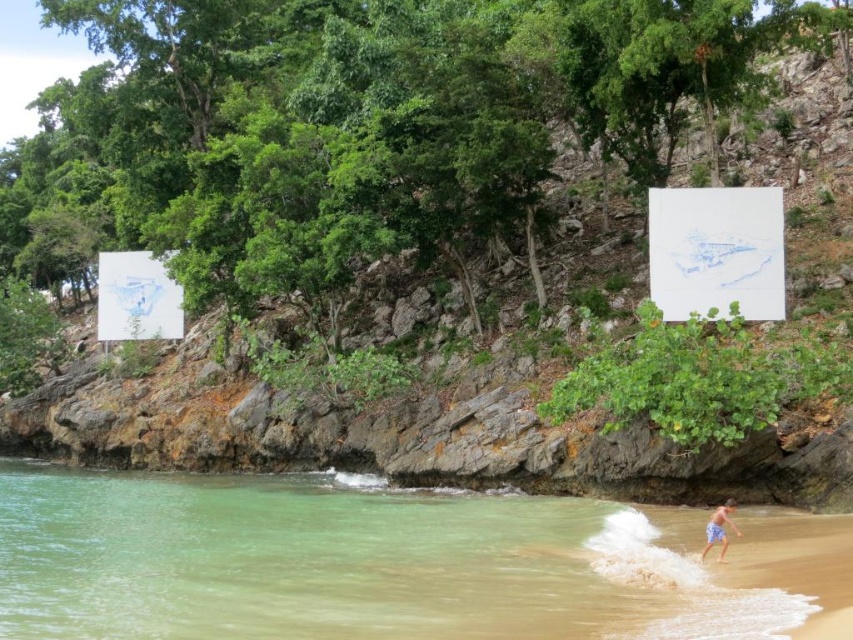
Question: Is clear water at beach right to the left of blue striped shorts at lower right from the viewer's perspective?

Choices:
 (A) yes
 (B) no

Answer: (A)

Question: Among these points, which one is farthest from the camera?

Choices:
 (A) (705, 545)
 (B) (291, 556)

Answer: (A)

Question: Observing the image, what is the correct spatial positioning of clear water at beach right in reference to blue striped shorts at lower right?

Choices:
 (A) left
 (B) right

Answer: (A)

Question: Which object appears closest to the camera in this image?

Choices:
 (A) blue striped shorts at lower right
 (B) clear water at beach right

Answer: (B)

Question: Is clear water at beach right above blue striped shorts at lower right?

Choices:
 (A) yes
 (B) no

Answer: (B)